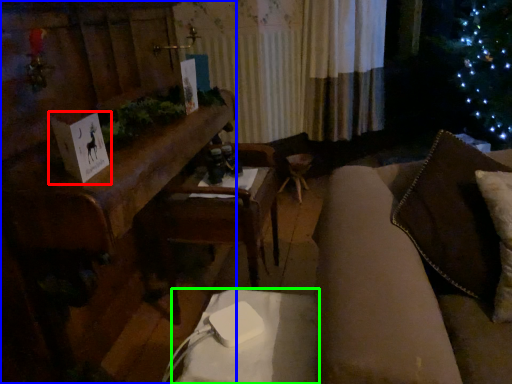
Question: Based on their relative distances, which object is nearer to christmas card (highlighted by a red box)? Choose from furniture (highlighted by a blue box) and table (highlighted by a green box).

Choices:
 (A) furniture
 (B) table

Answer: (A)